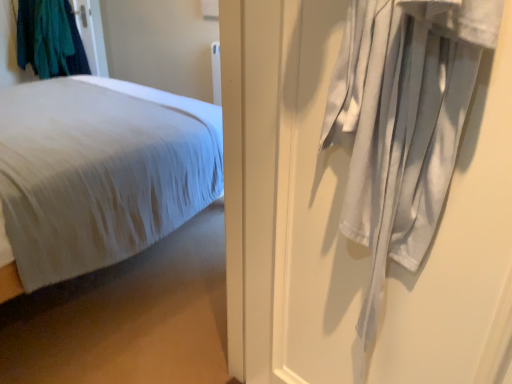
Where is `empty space that is ontop of white soft bed at left`? This screenshot has width=512, height=384. empty space that is ontop of white soft bed at left is located at coordinates (66, 98).